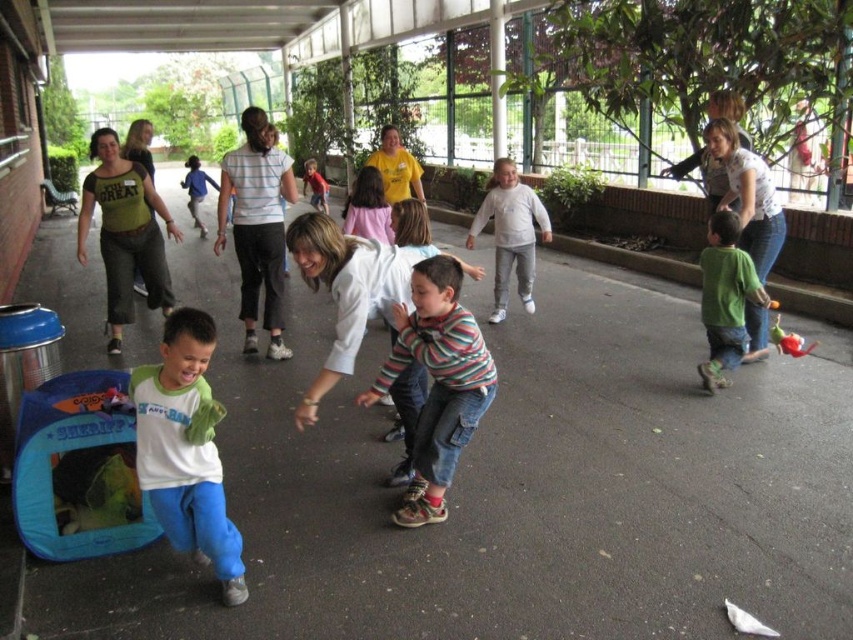
You are standing at the entrance of the covered walkway and see the white matte shirt at center. If you want to walk directly towards it, in which direction should you move?

Since the white matte shirt at center is located at point 2D coordinates of (x=186, y=449), you should move towards the center area of the walkway to reach it.

You are standing at the point marked by the coordinates point (186, 449) in the image. What object are you currently standing on?

The point (186, 449) marks the white matte shirt at center, so you are standing on the white matte shirt at center.